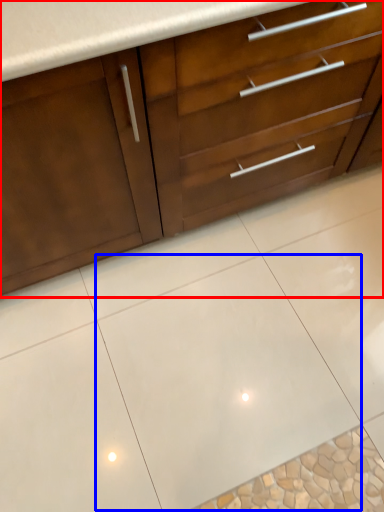
Question: Among these objects, which one is nearest to the camera, cabinetry (highlighted by a red box) or ceramic tile (highlighted by a blue box)?

Choices:
 (A) cabinetry
 (B) ceramic tile

Answer: (A)